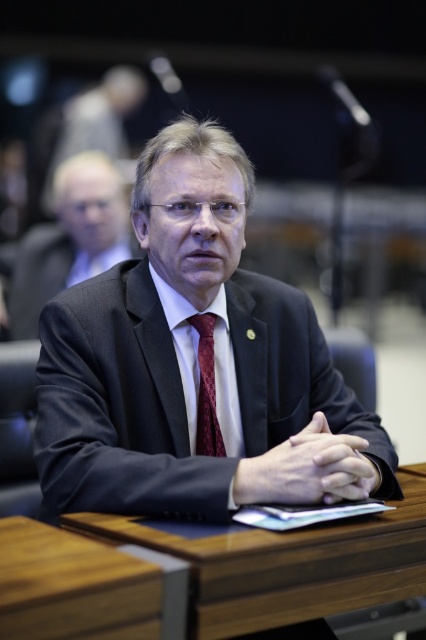
Where is `dark blue suit at center`? The height and width of the screenshot is (640, 426). dark blue suit at center is located at coordinates (195, 364).

Is dark blue suit at center below matte black suit at center?

Yes.

Find the location of a particular element. Image resolution: width=426 pixels, height=640 pixels. dark blue suit at center is located at coordinates click(195, 364).

Does dark blue suit at center appear on the right side of burgundy woven tie at center?

Correct, you'll find dark blue suit at center to the right of burgundy woven tie at center.

The width and height of the screenshot is (426, 640). What do you see at coordinates (195, 364) in the screenshot?
I see `dark blue suit at center` at bounding box center [195, 364].

Where is `dark blue suit at center`? The image size is (426, 640). dark blue suit at center is located at coordinates (195, 364).

Does wooden table at center have a lesser width compared to matte black suit at center?

No, wooden table at center is not thinner than matte black suit at center.

Is point (328, 563) less distant than point (60, 179)?

Yes.

Find the location of a particular element. Image resolution: width=426 pixels, height=640 pixels. wooden table at center is located at coordinates (284, 563).